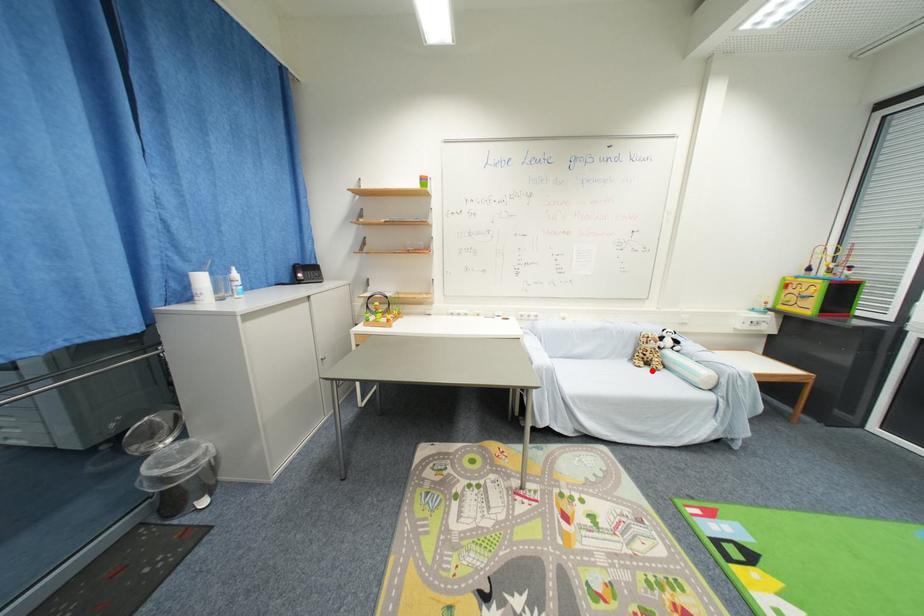
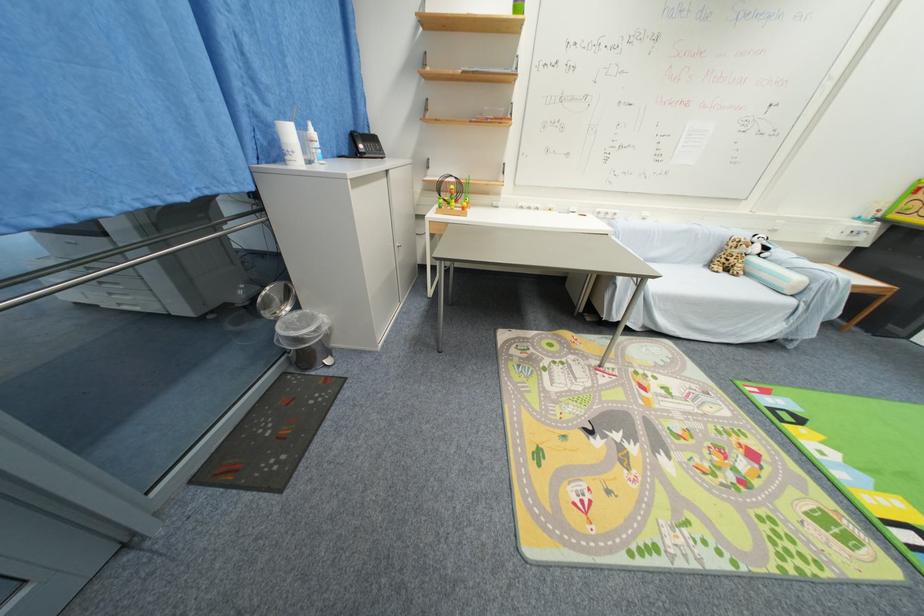
Where in the second image is the point corresponding to the highlighted location from the first image?

(730, 276)